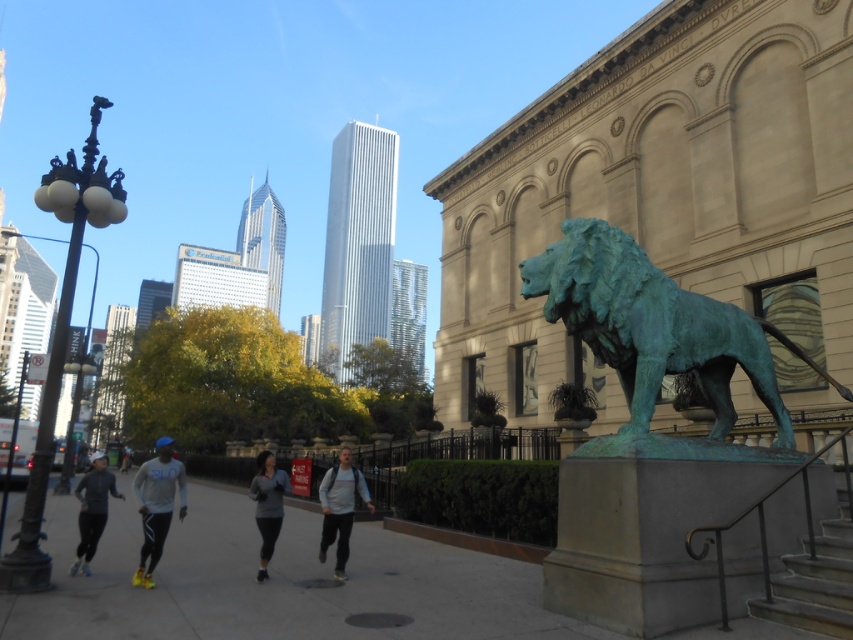
Question: Among these points, which one is farthest from the camera?

Choices:
 (A) (332, 490)
 (B) (165, 563)
 (C) (184, 499)
 (D) (265, 452)

Answer: (D)

Question: Can you confirm if green patina lion at right is wider than matte blue hoodie at center?

Choices:
 (A) no
 (B) yes

Answer: (A)

Question: Where is gray concrete pavement at lower center located in relation to metallic gray stairs at lower right in the image?

Choices:
 (A) above
 (B) below

Answer: (B)

Question: Which of the following is the farthest from the observer?

Choices:
 (A) (674, 316)
 (B) (322, 513)
 (C) (88, 500)
 (D) (815, 624)

Answer: (B)

Question: From the image, what is the correct spatial relationship of green patina lion at right in relation to matte blue hoodie at center?

Choices:
 (A) below
 (B) above

Answer: (B)

Question: Estimate the real-world distances between objects in this image. Which object is closer to the metallic gray stairs at lower right?

Choices:
 (A) gray fabric jacket at center
 (B) gray fleece jacket at center

Answer: (B)